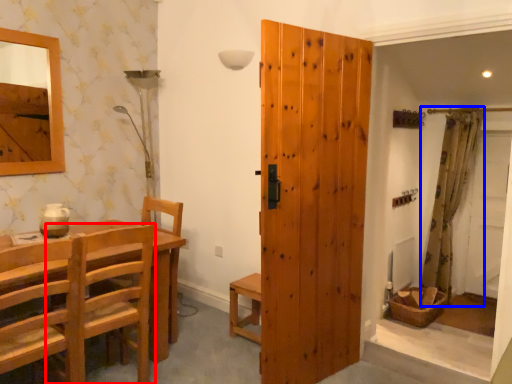
Question: Which object appears closest to the camera in this image, chair (highlighted by a red box) or curtain (highlighted by a blue box)?

Choices:
 (A) chair
 (B) curtain

Answer: (A)